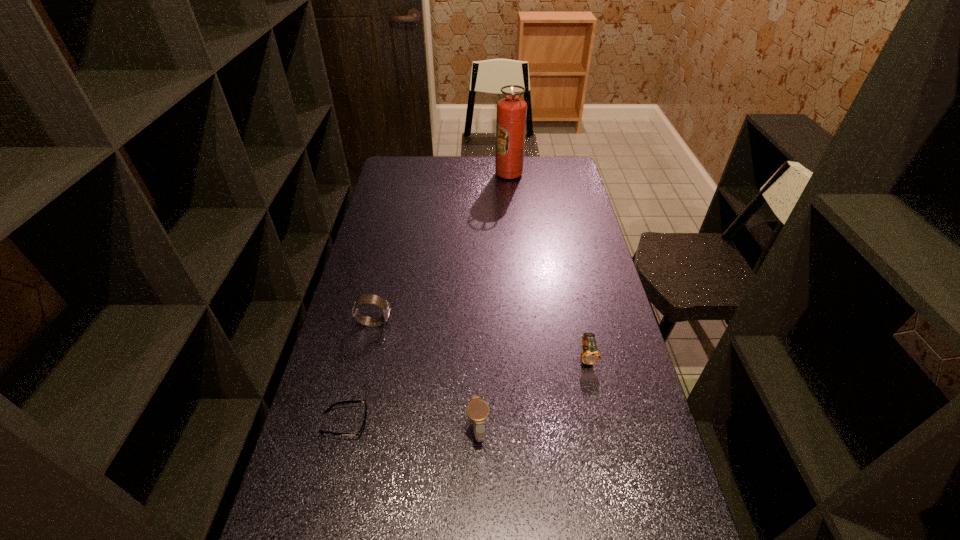
Image resolution: width=960 pixels, height=540 pixels. Identify the location of the tallest object. (511, 111).

The width and height of the screenshot is (960, 540). Identify the location of fire extinguisher. (511, 111).

Where is `the fourth nearest object`? the fourth nearest object is located at coordinates (368, 298).

Locate an element on the screen. The image size is (960, 540). the leftmost watch is located at coordinates (368, 298).

This screenshot has height=540, width=960. What are the coordinates of `the second watch from left to right` in the screenshot? It's located at point(477,410).

In order to click on the nearest watch in this screenshot , I will do `click(477, 410)`.

I want to click on the rightmost watch, so click(x=590, y=355).

The image size is (960, 540). Find the location of `the rightmost object`. the rightmost object is located at coordinates (590, 355).

This screenshot has width=960, height=540. Identify the location of the shortest object. (360, 432).

Find the location of a particular element. vacant region located 0.100m on the label side of the tallest object is located at coordinates (474, 174).